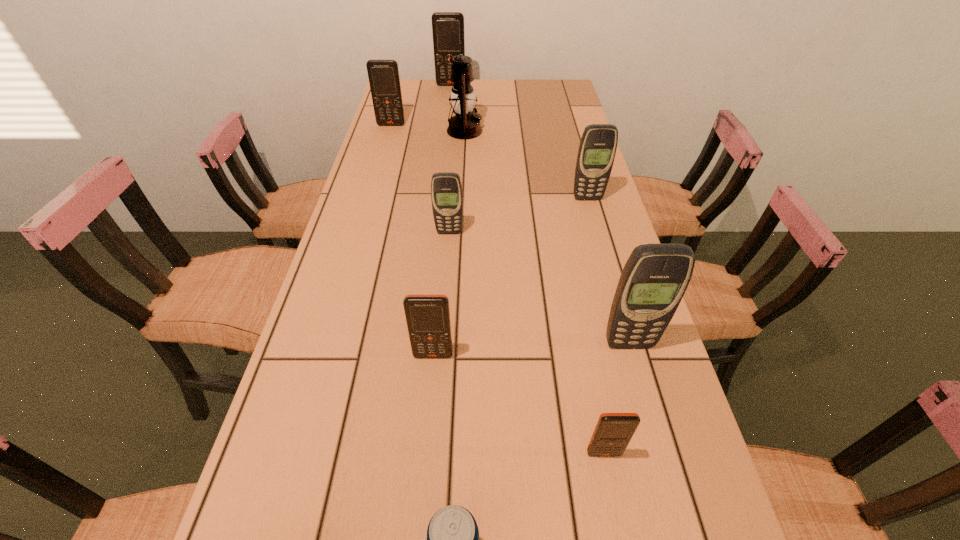
Locate an element on the screen. the smallest gray cellular telephone is located at coordinates [x=446, y=189].

You are a GUI agent. You are given a task and a screenshot of the screen. Output one action in this format:
    pyautogui.click(x=<x>, y=<y>)
    Task: Click on the sixth farthest cellular telephone
    
    Given the screenshot: What is the action you would take?
    pyautogui.click(x=428, y=316)

Locate an element on the screen. This screenshot has width=960, height=540. the third farthest orange cellular telephone is located at coordinates (428, 316).

Locate an element on the screen. the shortest cellular telephone is located at coordinates (613, 432).

The height and width of the screenshot is (540, 960). What are the coordinates of `the rightmost orange cellular telephone` in the screenshot? It's located at (613, 432).

Identify the location of blank space located 0.250m on the side of the lantern, there is a wick adjustment knob. Image resolution: width=960 pixels, height=540 pixels. (554, 131).

Find the location of `vacant space located on the screen of the farthest cellular telephone`. vacant space located on the screen of the farthest cellular telephone is located at coordinates (448, 110).

The height and width of the screenshot is (540, 960). Find the location of `vacant space located on the screen of the biggest gray cellular telephone`. vacant space located on the screen of the biggest gray cellular telephone is located at coordinates (658, 445).

Where is `vacant space located on the screen of the second biggest orange cellular telephone`? This screenshot has height=540, width=960. vacant space located on the screen of the second biggest orange cellular telephone is located at coordinates (383, 155).

I want to click on vacant space located 0.090m on the screen of the farthest gray cellular telephone, so click(593, 221).